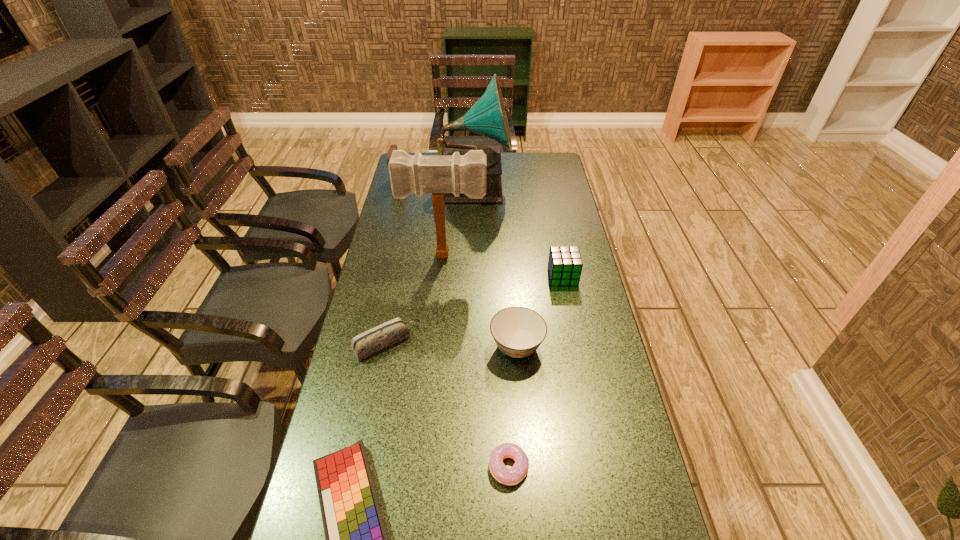
In order to click on vacant region located on the front of the seventh shortest object in this screenshot , I will do `click(439, 321)`.

Where is `vacant space located with an open flap on the sixth shortest object`? The width and height of the screenshot is (960, 540). vacant space located with an open flap on the sixth shortest object is located at coordinates (420, 184).

Find the location of `vacant space located on the left of the cube`. vacant space located on the left of the cube is located at coordinates (438, 276).

In order to click on vacant point located on the front of the soup bowl in this screenshot , I will do `click(527, 483)`.

Locate an element on the screen. Image resolution: width=960 pixels, height=540 pixels. free region located 0.300m on the back of the third shortest object is located at coordinates click(x=402, y=261).

In order to click on free space located on the back of the doughnut in this screenshot , I will do `click(505, 393)`.

Locate an element on the screen. This screenshot has width=960, height=540. record player located at the far edge is located at coordinates (487, 117).

Locate an element on the screen. pouch positioned at the far edge is located at coordinates (393, 147).

In order to click on mallet located in the left edge section of the desktop in this screenshot , I will do [x=418, y=174].

This screenshot has height=540, width=960. Identify the location of pouch present at the left edge. (393, 147).